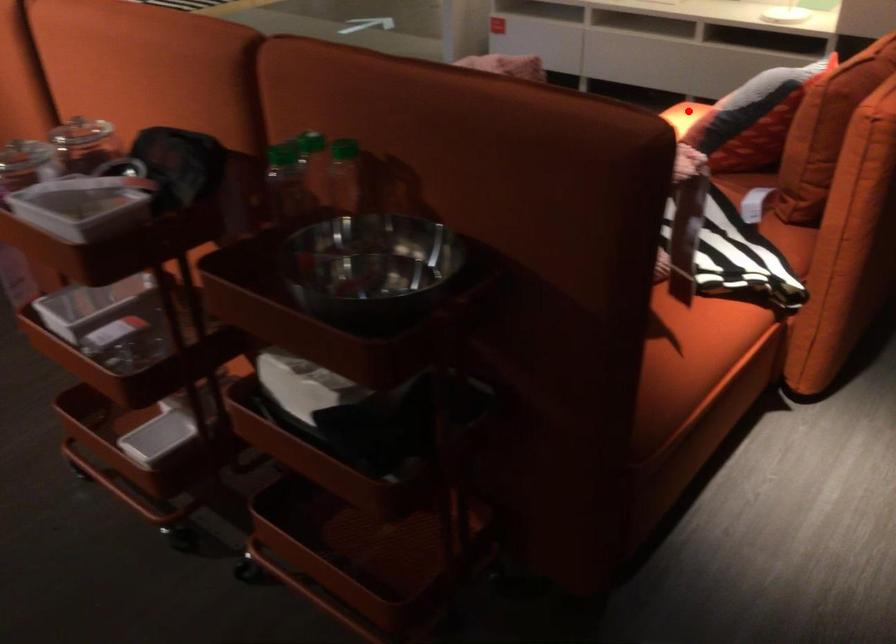
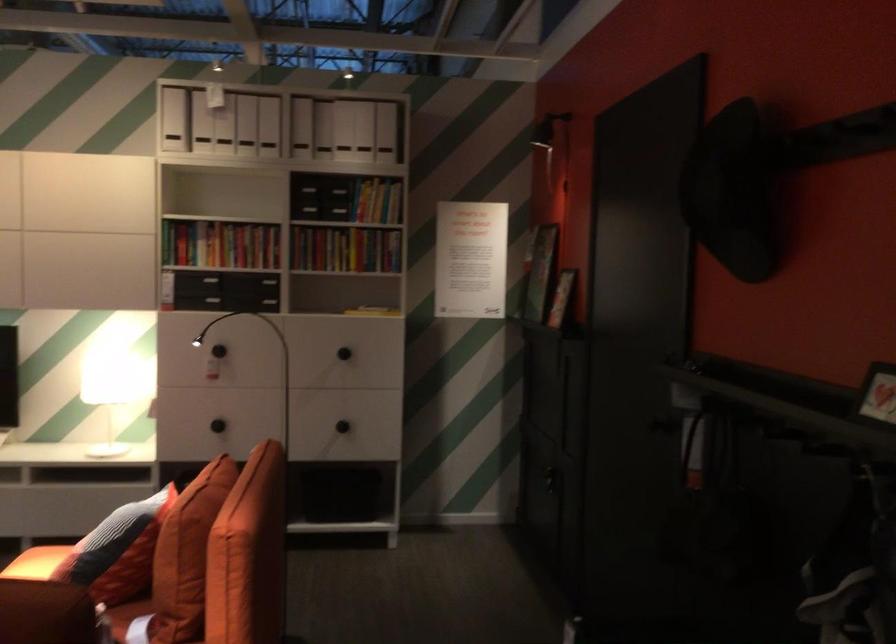
Question: I am providing you with two images of the same scene from different viewpoints. A red point is marked on the first image. Is the red point's position out of view in image 2?

Choices:
 (A) Yes
 (B) No

Answer: (B)